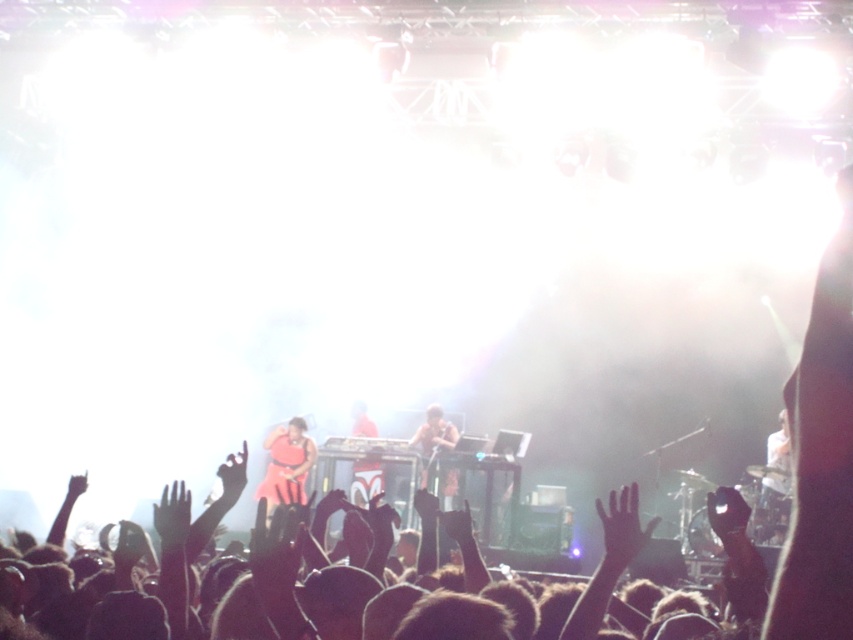
Who is positioned more to the right, transparent glass hand at center or shiny brown microphone at center?

From the viewer's perspective, transparent glass hand at center appears more on the right side.

Does transparent glass hand at center appear on the left side of shiny brown microphone at center?

No, transparent glass hand at center is not to the left of shiny brown microphone at center.

Is point (618, 529) more distant than point (437, 436)?

That is False.

Locate an element on the screen. transparent glass hand at center is located at coordinates (622, 528).

Is point (236, 481) more distant than point (73, 497)?

That is False.

Describe the element at coordinates (233, 474) in the screenshot. I see `black matte hand at lower left` at that location.

Is point (228, 488) less distant than point (74, 483)?

Yes, point (228, 488) is closer to viewer.

You are a GUI agent. You are given a task and a screenshot of the screen. Output one action in this format:
    pyautogui.click(x=<x>, y=<y>)
    Task: Click on the black matte hand at lower left
    Image resolution: width=853 pixels, height=640 pixels.
    Given the screenshot: What is the action you would take?
    pyautogui.click(x=233, y=474)

Between transparent plastic hand at upper left and black matte hand at lower left, which one is positioned lower?

black matte hand at lower left is lower down.

Which is in front, point (160, 512) or point (224, 476)?

Point (160, 512) is in front.

The height and width of the screenshot is (640, 853). I want to click on transparent plastic hand at upper left, so click(172, 516).